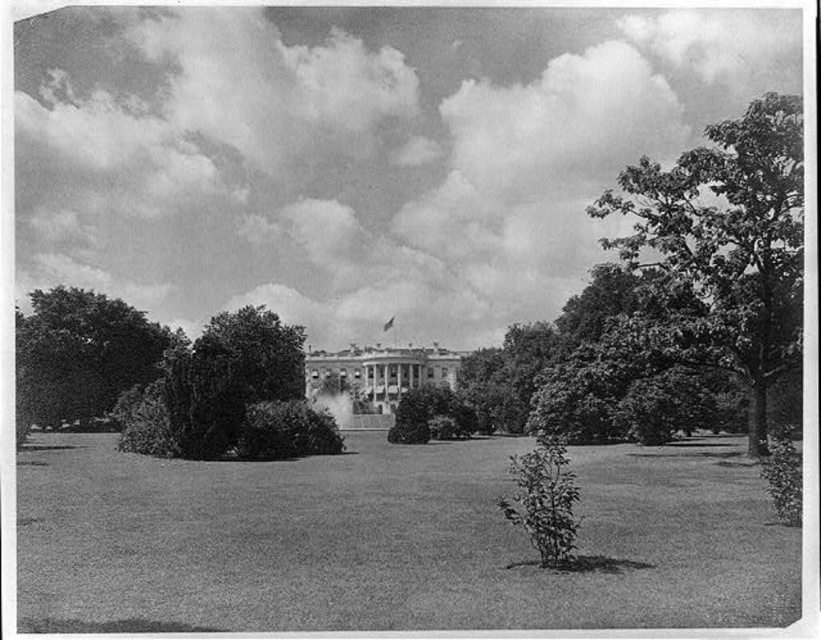
Question: Which point is closer to the camera taking this photo?

Choices:
 (A) (46, 364)
 (B) (555, 557)

Answer: (B)

Question: Can you confirm if green grass at lower center is smaller than thick green bush at center?

Choices:
 (A) yes
 (B) no

Answer: (B)

Question: Does green grass at lower center have a lesser width compared to dark green leafy bush at lower center?

Choices:
 (A) yes
 (B) no

Answer: (B)

Question: Which object is farther from the camera taking this photo?

Choices:
 (A) smooth green tree at right
 (B) green grass at lower center

Answer: (A)

Question: Which point appears farthest from the camera in this image?

Choices:
 (A) (510, 468)
 (B) (425, 420)
 (C) (599, 616)
 (D) (102, 406)

Answer: (D)

Question: Can you confirm if dark green leafy tree at left is thinner than green leafy bush at center?

Choices:
 (A) no
 (B) yes

Answer: (A)